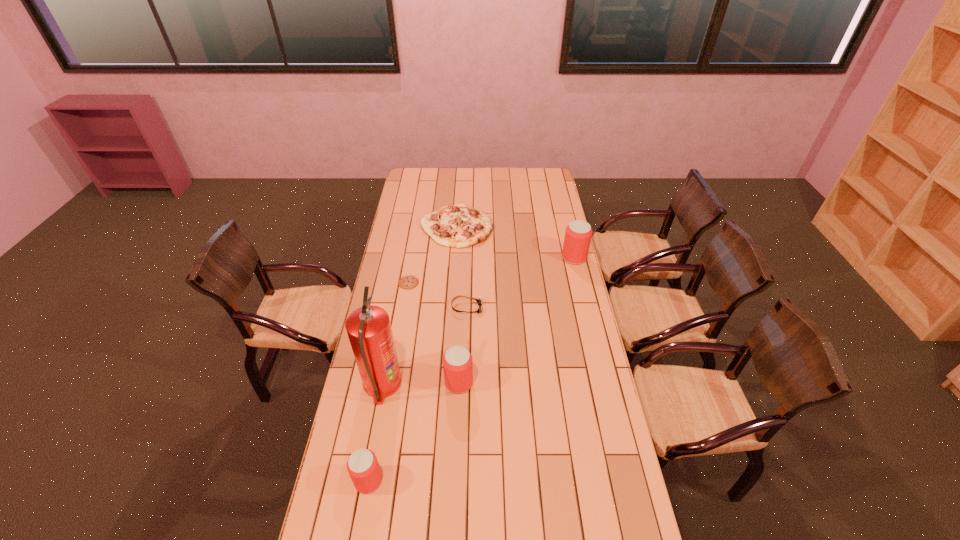
You are a GUI agent. You are given a task and a screenshot of the screen. Output one action in this format:
    pyautogui.click(x=<x>, y=<y>)
    Task: Click on the nearest beer can
    The width and height of the screenshot is (960, 540).
    Given the screenshot: What is the action you would take?
    pyautogui.click(x=363, y=467)

The image size is (960, 540). I want to click on the leftmost beer can, so click(363, 467).

This screenshot has height=540, width=960. Identify the location of the second tallest beer can. (457, 361).

The width and height of the screenshot is (960, 540). Find the location of `the third tallest object`. the third tallest object is located at coordinates (457, 361).

The width and height of the screenshot is (960, 540). Find the location of `the sixth nearest object`. the sixth nearest object is located at coordinates (578, 234).

This screenshot has width=960, height=540. I want to click on the rightmost object, so click(x=578, y=234).

This screenshot has width=960, height=540. What are the coordinates of `the third farthest object` in the screenshot? It's located at 407,282.

Identify the location of cookie. The width and height of the screenshot is (960, 540). (407, 282).

You are a GUI agent. You are given a task and a screenshot of the screen. Output one action in this format:
    pyautogui.click(x=<x>, y=<y>)
    Task: Click on the farthest object
    
    Given the screenshot: What is the action you would take?
    pyautogui.click(x=459, y=226)

Find the location of a particular element. The width and height of the screenshot is (960, 540). the tallest object is located at coordinates (369, 330).